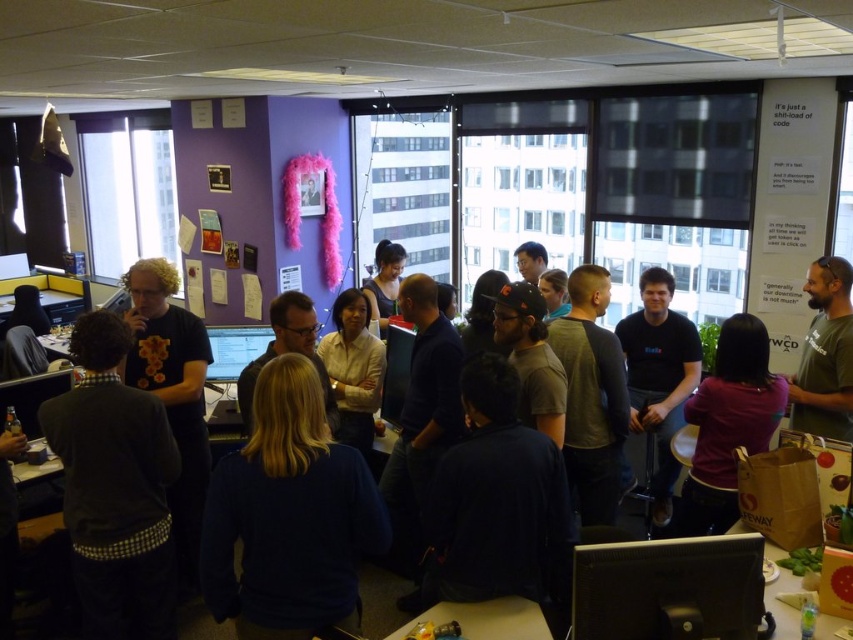
You are a delivery person who needs to place a box between the purple matte shirt at center and the matte black monitor at center. The box is 2 meters long. Can you fit it between them without moving either object?

The distance between the purple matte shirt at center and the matte black monitor at center is 2.30 meters. Since the box is 2 meters long, it can fit between them as there is enough space.

You are an office worker who needs to present a document on the black glossy monitor at lower right. However, you notice the black matte shirt at center is blocking your view. Can you see the monitor clearly from your current position?

The black glossy monitor at lower right is in front of the black matte shirt at center, so you can see the monitor clearly because it is not obstructed by the shirt.

You are standing in the office and want to take a photo of both the point at coordinates (x=633, y=570) and the point at (x=248, y=346). Which point should you focus on first to ensure both are in clear view?

You should focus on the point at coordinates (x=633, y=570) first because it is closer to the camera than the point at (x=248, y=346), ensuring both points remain in focus.